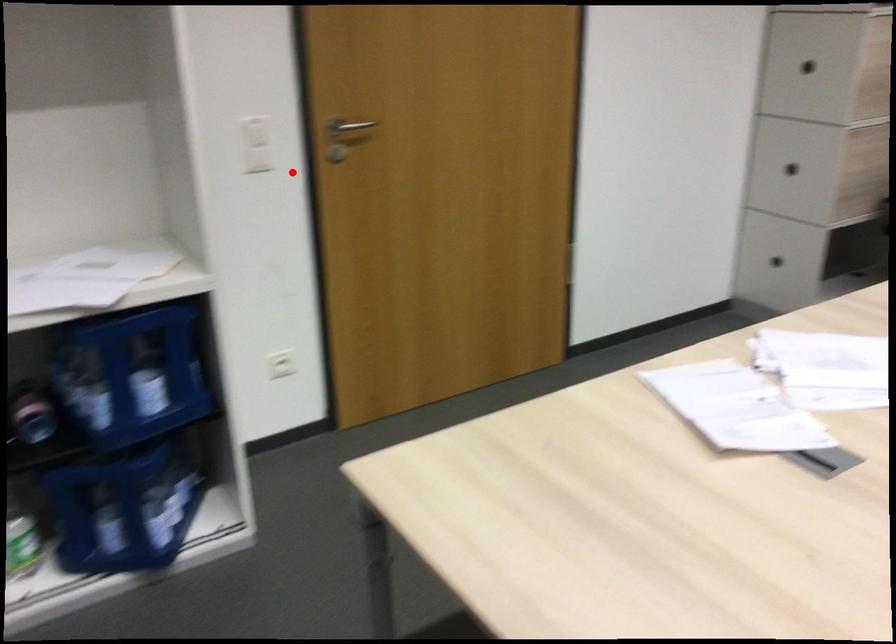
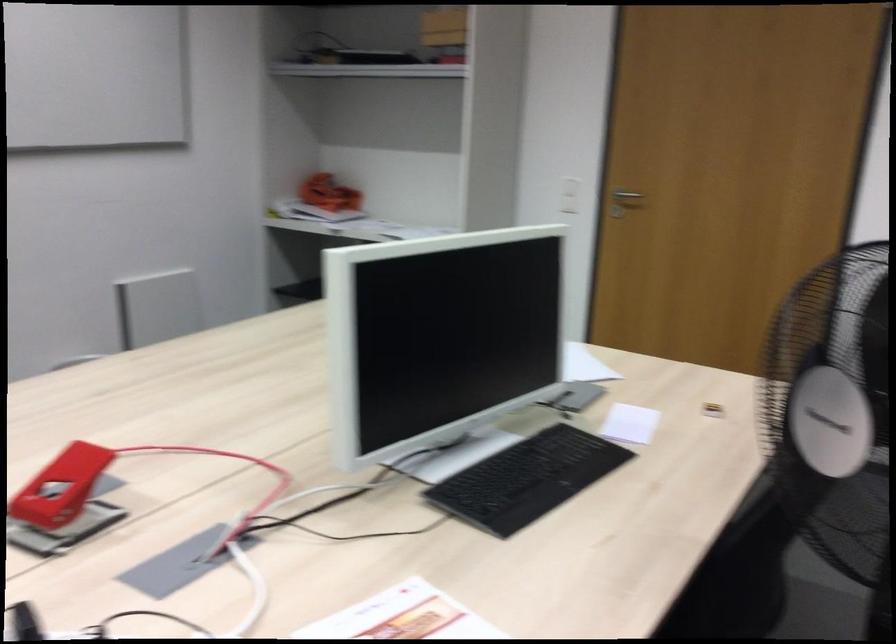
Question: I am providing you with two images of the same scene from different viewpoints. Given a red point in image1, look at the same physical point in image2. Is it:

Choices:
 (A) Closer to the viewpoint
 (B) Farther from the viewpoint

Answer: (B)